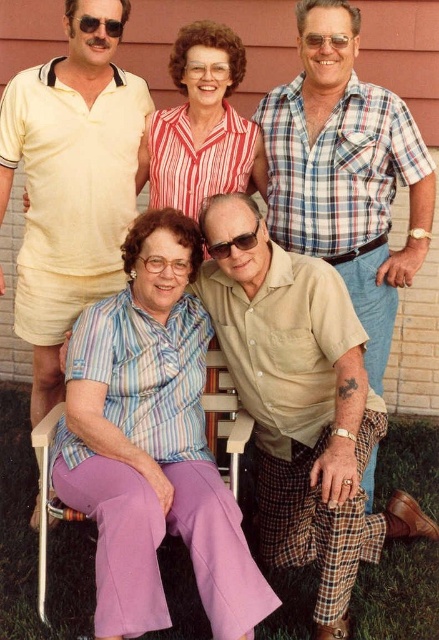
Is beige plaid shorts at lower center above striped cotton blouse at upper center?

No.

Between beige plaid shorts at lower center and striped cotton blouse at upper center, which one appears on the right side from the viewer's perspective?

beige plaid shorts at lower center is more to the right.

Does point (316, 209) lie behind point (205, 163)?

No, (316, 209) is in front of (205, 163).

You are a GUI agent. You are given a task and a screenshot of the screen. Output one action in this format:
    pyautogui.click(x=<x>, y=<y>)
    Task: Click on the beige plaid shorts at lower center
    The image size is (439, 640).
    Given the screenshot: What is the action you would take?
    pyautogui.click(x=346, y=173)

Looking at this image, measure the distance between striped fabric blouse at center and camera.

striped fabric blouse at center is 7.10 feet from camera.

Looking at this image, which is more to the right, striped fabric blouse at center or matte black sunglasses at upper center?

striped fabric blouse at center

In order to click on striped fabric blouse at center in this screenshot , I will do `click(151, 444)`.

Is beige cotton shirt at center to the left of striped cotton blouse at upper center from the viewer's perspective?

No, beige cotton shirt at center is not to the left of striped cotton blouse at upper center.

Does beige cotton shirt at center have a lesser width compared to striped cotton blouse at upper center?

No, beige cotton shirt at center is not thinner than striped cotton blouse at upper center.

Between point (233, 374) and point (205, 150), which one is positioned in front?

Point (233, 374)

Image resolution: width=439 pixels, height=640 pixels. Identify the location of beige cotton shirt at center. (302, 404).